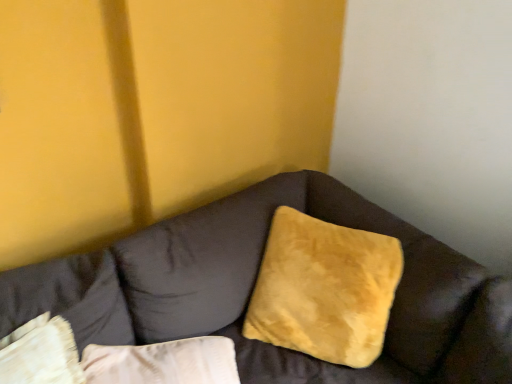
What do you see at coordinates (69, 298) in the screenshot? The image size is (512, 384). I see `velvet beige pillow at lower left, which is counted as the first pillow, starting from the left` at bounding box center [69, 298].

Locate an element on the screen. velvet beige pillow at lower left, which is counted as the first pillow, starting from the left is located at coordinates (69, 298).

Is suede-like brown couch at center wider or thinner than suede yellow pillow at center, positioned as the first pillow in right-to-left order?

suede-like brown couch at center is wider than suede yellow pillow at center, positioned as the first pillow in right-to-left order.

Is suede-like brown couch at center surrounding suede yellow pillow at center, positioned as the first pillow in right-to-left order?

Yes, suede yellow pillow at center, positioned as the first pillow in right-to-left order, is inside suede-like brown couch at center.

Based on their positions, is suede-like brown couch at center located to the left or right of suede yellow pillow at center, which ranks as the second pillow in left-to-right order?

From the image, it's evident that suede-like brown couch at center is to the left of suede yellow pillow at center, which ranks as the second pillow in left-to-right order.

Identify the location of studio couch below the suede yellow pillow at center, which ranks as the second pillow in left-to-right order (from a real-world perspective). The image size is (512, 384). (253, 286).

Could velvet beige pillow at lower left, the 2th pillow viewed from the right, be considered to be inside suede-like brown couch at center?

Yes, velvet beige pillow at lower left, the 2th pillow viewed from the right, is a part of suede-like brown couch at center.

Is suede-like brown couch at center positioned with its back to velvet beige pillow at lower left, the 2th pillow viewed from the right?

No, suede-like brown couch at center is not facing the opposite direction of velvet beige pillow at lower left, the 2th pillow viewed from the right.

Can you confirm if suede-like brown couch at center is positioned to the left of velvet beige pillow at lower left, which is counted as the first pillow, starting from the left?

Incorrect, suede-like brown couch at center is not on the left side of velvet beige pillow at lower left, which is counted as the first pillow, starting from the left.

In terms of height, does suede-like brown couch at center look taller or shorter compared to velvet beige pillow at lower left, which is counted as the first pillow, starting from the left?

In the image, suede-like brown couch at center appears to be taller than velvet beige pillow at lower left, which is counted as the first pillow, starting from the left.

Does point (112, 286) lie in front of point (262, 278)?

That is True.

Is velvet beige pillow at lower left, which is counted as the first pillow, starting from the left, to the left of suede yellow pillow at center, positioned as the first pillow in right-to-left order, from the viewer's perspective?

Correct, you'll find velvet beige pillow at lower left, which is counted as the first pillow, starting from the left, to the left of suede yellow pillow at center, positioned as the first pillow in right-to-left order.

What's the angular difference between velvet beige pillow at lower left, the 2th pillow viewed from the right, and suede yellow pillow at center, which ranks as the second pillow in left-to-right order,'s facing directions?

The facing directions of velvet beige pillow at lower left, the 2th pillow viewed from the right, and suede yellow pillow at center, which ranks as the second pillow in left-to-right order, are 56.3 degrees apart.

Is velvet beige pillow at lower left, the 2th pillow viewed from the right, thinner than suede-like brown couch at center?

Indeed, velvet beige pillow at lower left, the 2th pillow viewed from the right, has a lesser width compared to suede-like brown couch at center.

Based on the photo, choose the correct answer: Is velvet beige pillow at lower left, the 2th pillow viewed from the right, inside suede-like brown couch at center or outside it?

velvet beige pillow at lower left, the 2th pillow viewed from the right, is spatially positioned inside suede-like brown couch at center.

From the image's perspective, who appears lower, velvet beige pillow at lower left, which is counted as the first pillow, starting from the left, or suede-like brown couch at center?

velvet beige pillow at lower left, which is counted as the first pillow, starting from the left, is shown below in the image.

Considering the relative positions of velvet beige pillow at lower left, which is counted as the first pillow, starting from the left, and suede-like brown couch at center in the image provided, is velvet beige pillow at lower left, which is counted as the first pillow, starting from the left, behind suede-like brown couch at center?

Yes, velvet beige pillow at lower left, which is counted as the first pillow, starting from the left, is further from the viewer.

Is suede yellow pillow at center, positioned as the first pillow in right-to-left order, not close to velvet beige pillow at lower left, which is counted as the first pillow, starting from the left?

suede yellow pillow at center, positioned as the first pillow in right-to-left order, is near velvet beige pillow at lower left, which is counted as the first pillow, starting from the left, not far away.

Considering the points (291, 338) and (93, 287), which point is in front, point (291, 338) or point (93, 287)?

Positioned in front is point (93, 287).

From the image's perspective, would you say suede yellow pillow at center, which ranks as the second pillow in left-to-right order, is positioned over velvet beige pillow at lower left, the 2th pillow viewed from the right?

Yes, from the image's perspective, suede yellow pillow at center, which ranks as the second pillow in left-to-right order, is on top of velvet beige pillow at lower left, the 2th pillow viewed from the right.

Is suede yellow pillow at center, positioned as the first pillow in right-to-left order, oriented towards velvet beige pillow at lower left, the 2th pillow viewed from the right?

No, suede yellow pillow at center, positioned as the first pillow in right-to-left order, does not turn towards velvet beige pillow at lower left, the 2th pillow viewed from the right.

In the image, there is a suede-like brown couch at center. At what (x,y) coordinates should I click in order to perform the action: click on pillow above it (from the image's perspective). Please return your answer as a coordinate pair (x, y). Looking at the image, I should click on (324, 289).

Which is in front, point (356, 237) or point (315, 183)?

Positioned in front is point (356, 237).

Which object is more forward, suede yellow pillow at center, which ranks as the second pillow in left-to-right order, or suede-like brown couch at center?

suede-like brown couch at center is more forward.

Who is shorter, suede yellow pillow at center, positioned as the first pillow in right-to-left order, or suede-like brown couch at center?

With less height is suede yellow pillow at center, positioned as the first pillow in right-to-left order.

This screenshot has width=512, height=384. Find the location of `studio couch on the left side of suede yellow pillow at center, which ranks as the second pillow in left-to-right order`. studio couch on the left side of suede yellow pillow at center, which ranks as the second pillow in left-to-right order is located at coordinates (253, 286).

Locate an element on the screen. The image size is (512, 384). pillow that appears below the suede-like brown couch at center (from the image's perspective) is located at coordinates (69, 298).

Based on their spatial positions, is velvet beige pillow at lower left, which is counted as the first pillow, starting from the left, or suede-like brown couch at center further from suede yellow pillow at center, which ranks as the second pillow in left-to-right order?

The object further to suede yellow pillow at center, which ranks as the second pillow in left-to-right order, is velvet beige pillow at lower left, which is counted as the first pillow, starting from the left.

From the image, which object appears to be farther from suede yellow pillow at center, which ranks as the second pillow in left-to-right order, suede-like brown couch at center or velvet beige pillow at lower left, which is counted as the first pillow, starting from the left?

Among the two, velvet beige pillow at lower left, which is counted as the first pillow, starting from the left, is located further to suede yellow pillow at center, which ranks as the second pillow in left-to-right order.

Based on their spatial positions, is velvet beige pillow at lower left, the 2th pillow viewed from the right, or suede yellow pillow at center, which ranks as the second pillow in left-to-right order, further from suede-like brown couch at center?

Based on the image, velvet beige pillow at lower left, the 2th pillow viewed from the right, appears to be further to suede-like brown couch at center.

From the image, which object appears to be farther from velvet beige pillow at lower left, which is counted as the first pillow, starting from the left, suede yellow pillow at center, positioned as the first pillow in right-to-left order, or suede-like brown couch at center?

suede yellow pillow at center, positioned as the first pillow in right-to-left order, is further to velvet beige pillow at lower left, which is counted as the first pillow, starting from the left.

Based on their spatial positions, is suede-like brown couch at center or suede yellow pillow at center, positioned as the first pillow in right-to-left order, further from velvet beige pillow at lower left, the 2th pillow viewed from the right?

suede yellow pillow at center, positioned as the first pillow in right-to-left order, is positioned further to the anchor velvet beige pillow at lower left, the 2th pillow viewed from the right.

From the image, which object appears to be farther from suede-like brown couch at center, suede yellow pillow at center, which ranks as the second pillow in left-to-right order, or velvet beige pillow at lower left, the 2th pillow viewed from the right?

velvet beige pillow at lower left, the 2th pillow viewed from the right.

What are the coordinates of `studio couch between velvet beige pillow at lower left, the 2th pillow viewed from the right, and suede yellow pillow at center, which ranks as the second pillow in left-to-right order, from left to right` in the screenshot? It's located at (253, 286).